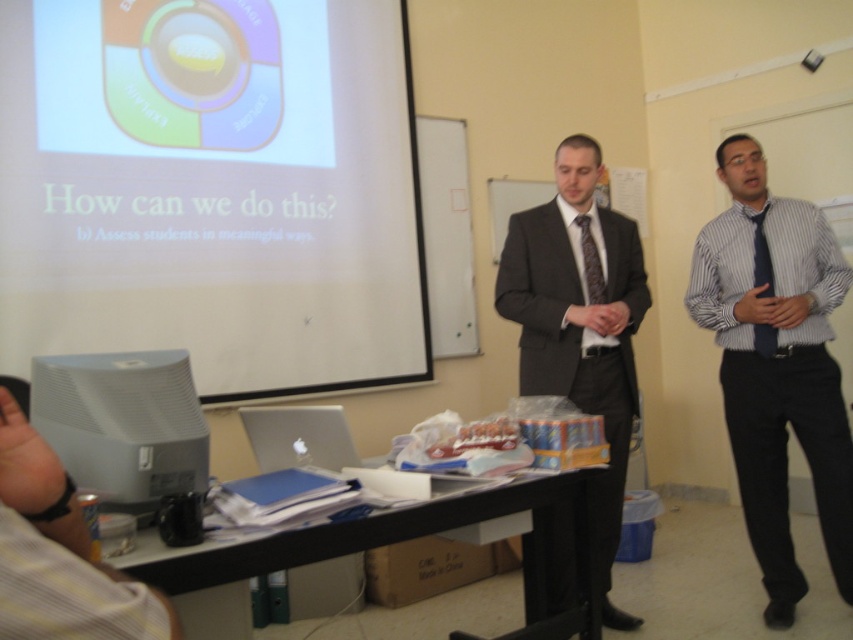
Question: Is dark gray suit at center thinner than white plastic computer at lower left?

Choices:
 (A) no
 (B) yes

Answer: (A)

Question: Which point appears farthest from the camera in this image?

Choices:
 (A) (338, 115)
 (B) (589, 243)

Answer: (A)

Question: Is dark gray suit at center further to camera compared to black wood table at center?

Choices:
 (A) yes
 (B) no

Answer: (A)

Question: Which object is farther from the camera taking this photo?

Choices:
 (A) white plastic computer at lower left
 (B) blue striped tie at right
 (C) blue striped shirt at right
 (D) white matte projection screen at upper left

Answer: (B)

Question: Is blue striped shirt at right further to camera compared to white plastic computer at lower left?

Choices:
 (A) yes
 (B) no

Answer: (A)

Question: Which object is the farthest from the dark brown textured tie at center?

Choices:
 (A) white matte projection screen at upper left
 (B) black wood table at center

Answer: (A)